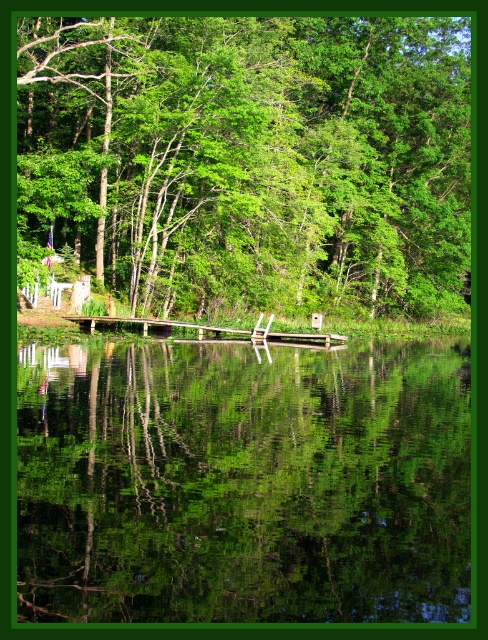
Who is more distant from viewer, (215, 280) or (306, 512)?

The point (215, 280) is more distant.

The image size is (488, 640). Describe the element at coordinates (251, 157) in the screenshot. I see `green leafy tree at upper center` at that location.

Locate an element on the screen. green leafy tree at upper center is located at coordinates (251, 157).

This screenshot has width=488, height=640. Identify the location of green leafy tree at upper center. (251, 157).